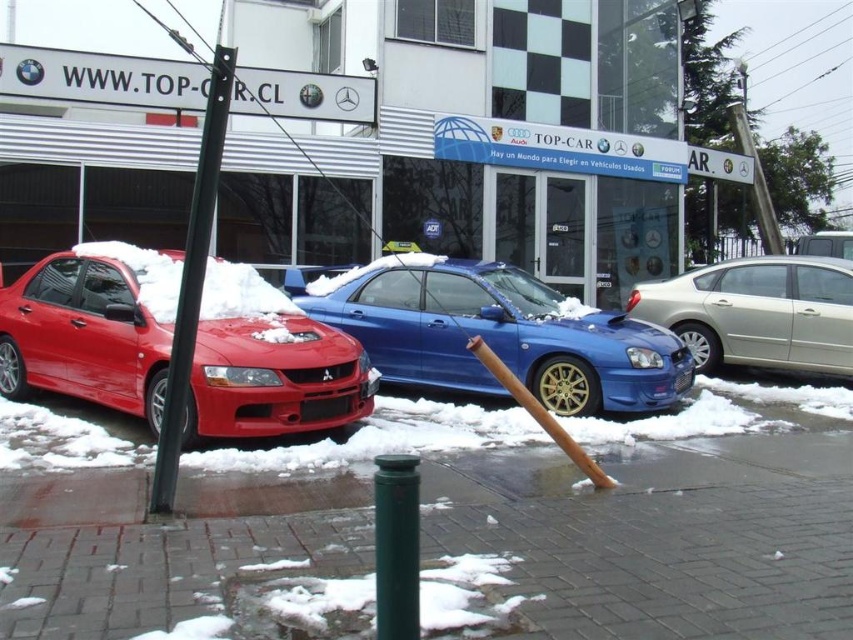
You are a delivery person who needs to load a package onto the roof of a car. The package requires at least 15 cm of clearance above the car to be safely placed. Which car between the matte red car at left and the metallic blue car at center would allow you to safely place the package?

The metallic blue car at center has a greater height than the matte red car at left, so the metallic blue car at center provides enough clearance for the package.

You are a delivery person trying to park a 1.8 meters wide delivery van between the black metal pole at left and the green matte pole at center. Can the van fit through the space between them?

The black metal pole at left is wider than the green matte pole at center. However, the width of the poles themselves does not determine the space between them. Without information about the distance between the poles, it is impossible to determine if the van can fit through the space between them.